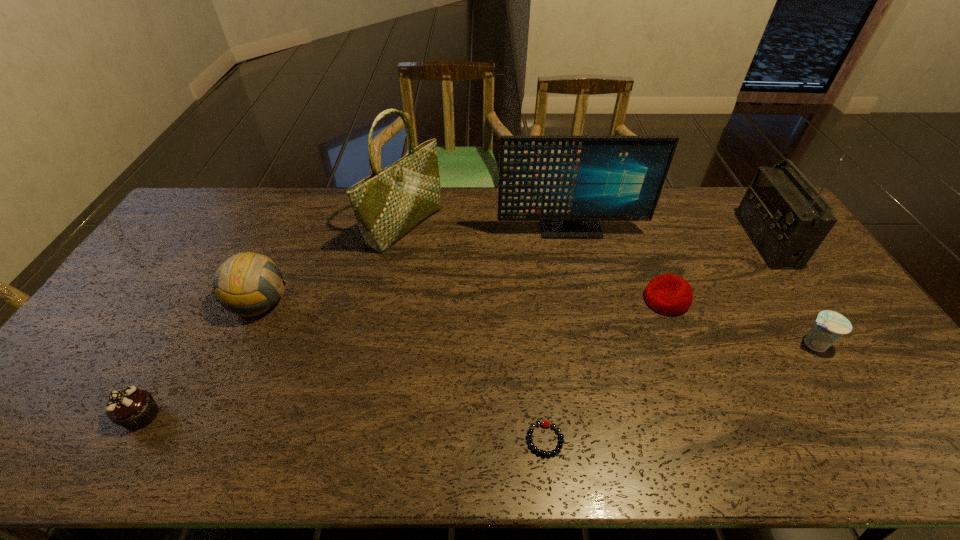
This screenshot has height=540, width=960. What are the coordinates of `vacant space located on the front panel of the radio receiver` in the screenshot? It's located at (690, 240).

Find the location of `vacant space situated on the front panel of the radio receiver`. vacant space situated on the front panel of the radio receiver is located at coordinates (666, 240).

Find the location of a particular element. This screenshot has height=540, width=960. vacant space situated on the front panel of the radio receiver is located at coordinates (699, 240).

Where is `free space located 0.240m on the screen side of the third tallest object`? The width and height of the screenshot is (960, 540). free space located 0.240m on the screen side of the third tallest object is located at coordinates (584, 292).

Find the location of a particular element. The image size is (960, 540). vacant space located 0.300m on the left of the fifth shortest object is located at coordinates (126, 302).

Where is `free space located on the left of the sixth farthest object`? The width and height of the screenshot is (960, 540). free space located on the left of the sixth farthest object is located at coordinates (752, 344).

This screenshot has height=540, width=960. In order to click on vacant space positioned 0.310m on the right of the cupcake in this screenshot , I will do `click(291, 416)`.

Identify the location of vacant space situated 0.090m on the seat area of the second shortest object. The height and width of the screenshot is (540, 960). (614, 300).

Find the location of `vacant area located on the seat area of the second shortest object`. vacant area located on the seat area of the second shortest object is located at coordinates (604, 300).

Locate an element on the screen. The width and height of the screenshot is (960, 540). vacant space situated 0.150m on the seat area of the second shortest object is located at coordinates (593, 300).